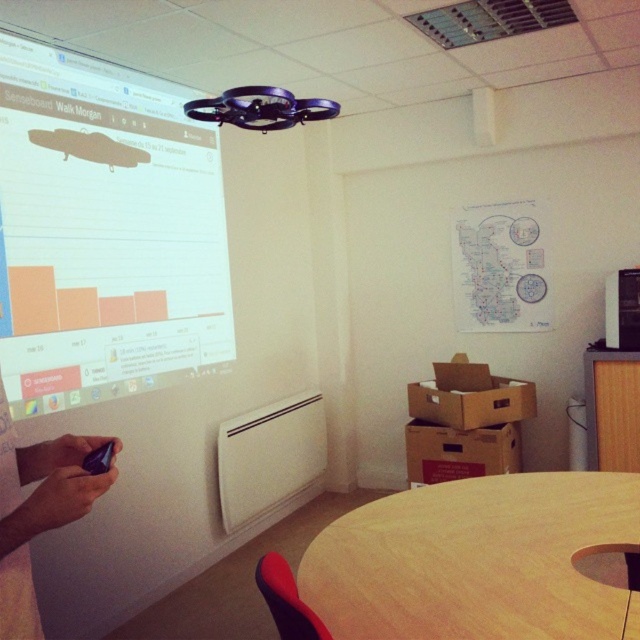
You are sitting at the wooden round table at lower center in the meeting room. You need to reach the black matte phone at lower left to take a call. Which direction should you move to get to the phone?

You should move to the left to reach the black matte phone at lower left since the wooden round table at lower center is positioned to the right of it.

You are setting up for a presentation and need to place a black matte phone at lower left so it doesn t block the white glossy projection screen at upper left. Based on their positions, will the phone be visible to the audience when the presentation is running?

The white glossy projection screen at upper left is positioned on the left side of black matte phone at lower left, meaning the phone is to the right of the screen. Since the phone is at lower left and the screen is above it, the phone should be visible to the audience as it is not directly blocking the screen.

You are a technician in the meeting room. You need to connect the black matte phone at lower left to the white glossy projection screen at upper left using a cable that is 6 feet long. Will the cable be long enough?

The white glossy projection screen at upper left is 6.14 feet away from the black matte phone at lower left. Since the cable is only 6 feet long, it is 0.14 feet shorter than needed. Therefore, the cable will not be long enough to connect the two devices.